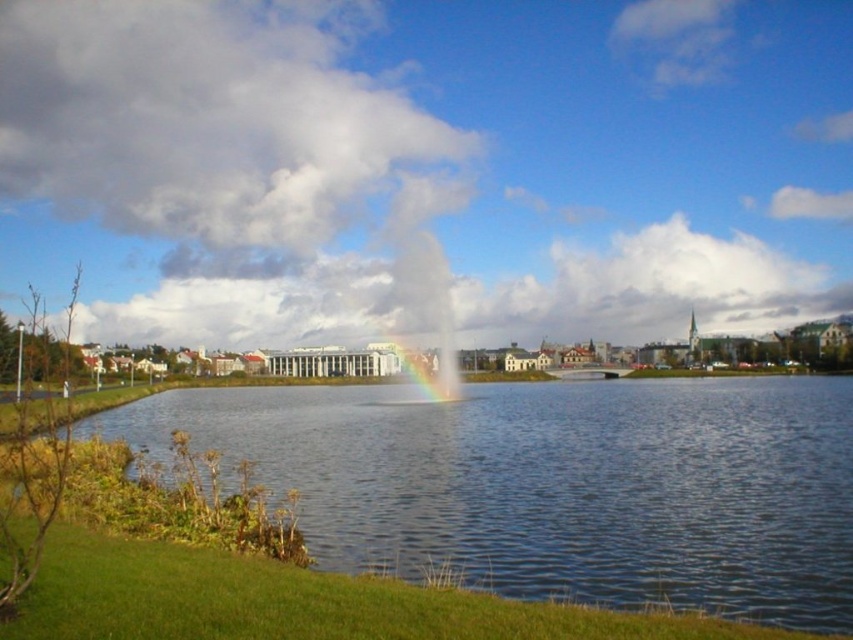
Consider the image. You are planning to take a photo of the clear water at center and the cloudy sky at upper center. Since you want both to be in focus, you need to know which one is closer to you. Which object is nearer to the observer?

The clear water at center is closer to the observer than the cloudy sky at upper center because objects that are closer appear larger, but in this case, the clear water at center has a smaller size compared to cloudy sky at upper center, indicating it is nearer.